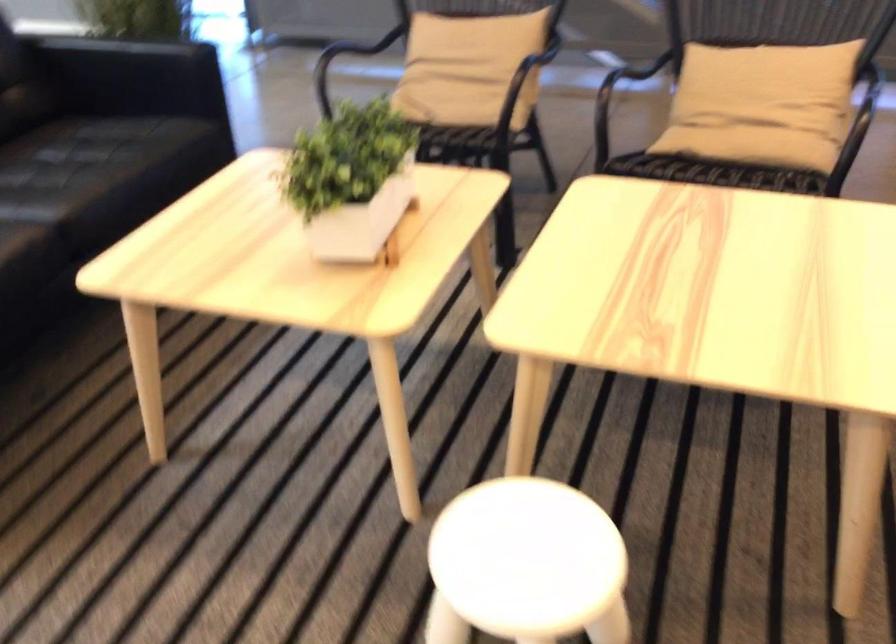
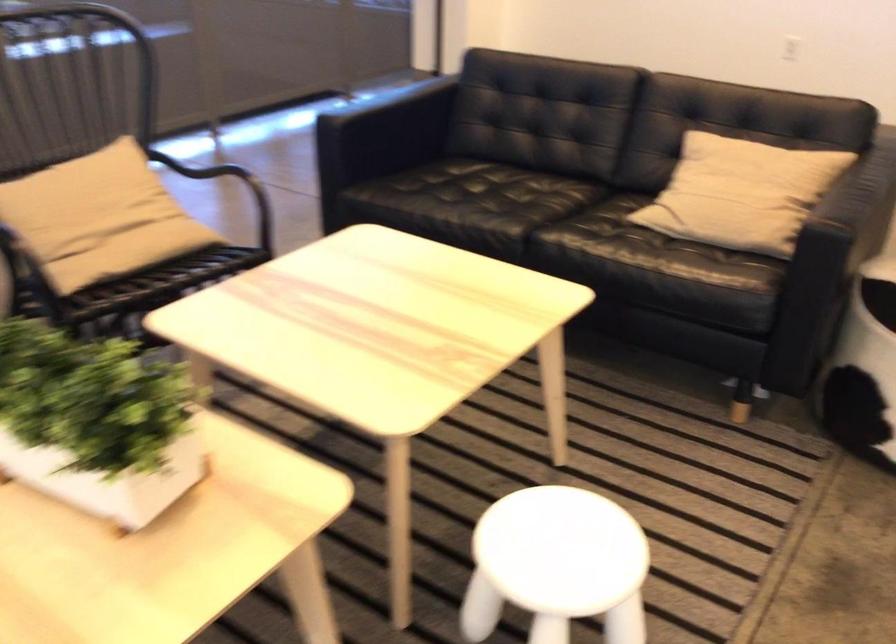
The point at (761,90) is marked in the first image. Where is the corresponding point in the second image?

(99, 214)